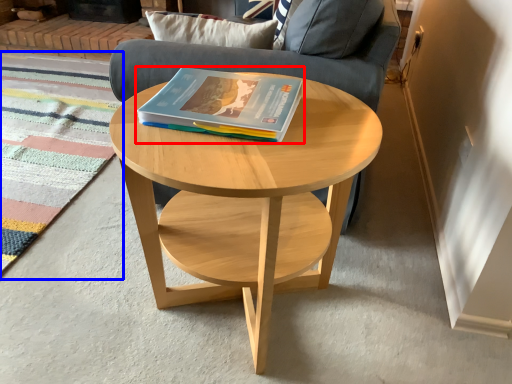
Question: Which object appears closest to the camera in this image, book (highlighted by a red box) or mat (highlighted by a blue box)?

Choices:
 (A) book
 (B) mat

Answer: (A)